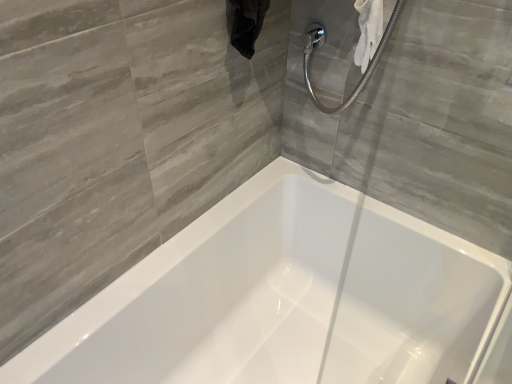
Where is `black fabric towel at upper center`? black fabric towel at upper center is located at coordinates (247, 24).

In order to face black fabric towel at upper center, should I rotate leftwards or rightwards?

Rotate your view left by about 1.037°.

What do you see at coordinates (247, 24) in the screenshot? The height and width of the screenshot is (384, 512). I see `black fabric towel at upper center` at bounding box center [247, 24].

Identify the location of black fabric towel at upper center. The height and width of the screenshot is (384, 512). (247, 24).